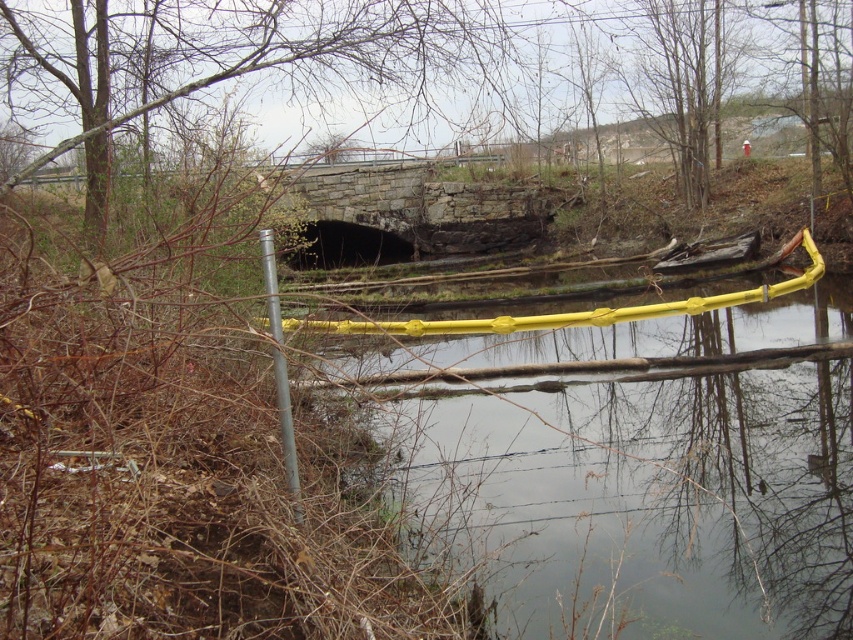
Question: Which of the following is the closest to the observer?

Choices:
 (A) (596, 445)
 (B) (273, 337)

Answer: (B)

Question: Does yellow rubber barrier at lower center have a smaller size compared to silver metallic pole at left?

Choices:
 (A) no
 (B) yes

Answer: (A)

Question: Is yellow rubber barrier at lower center bigger than silver metallic pole at left?

Choices:
 (A) yes
 (B) no

Answer: (A)

Question: Is yellow rubber barrier at lower center to the right of silver metallic pole at left from the viewer's perspective?

Choices:
 (A) no
 (B) yes

Answer: (B)

Question: Which point is closer to the camera taking this photo?

Choices:
 (A) (299, 484)
 (B) (746, 625)

Answer: (A)